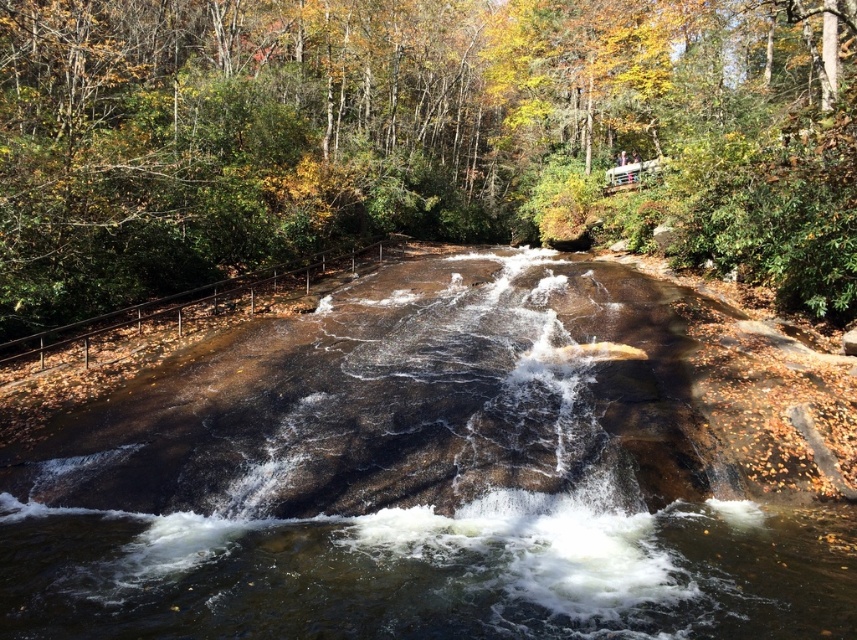
Who is positioned more to the left, brown rock river at center or brown textured rock at center?

Positioned to the left is brown rock river at center.

Is brown rock river at center taller than brown textured rock at center?

In fact, brown rock river at center may be shorter than brown textured rock at center.

Does point (361, 586) lie in front of point (370, 38)?

Yes, point (361, 586) is closer to viewer.

Where is `brown rock river at center`? The width and height of the screenshot is (857, 640). brown rock river at center is located at coordinates (412, 481).